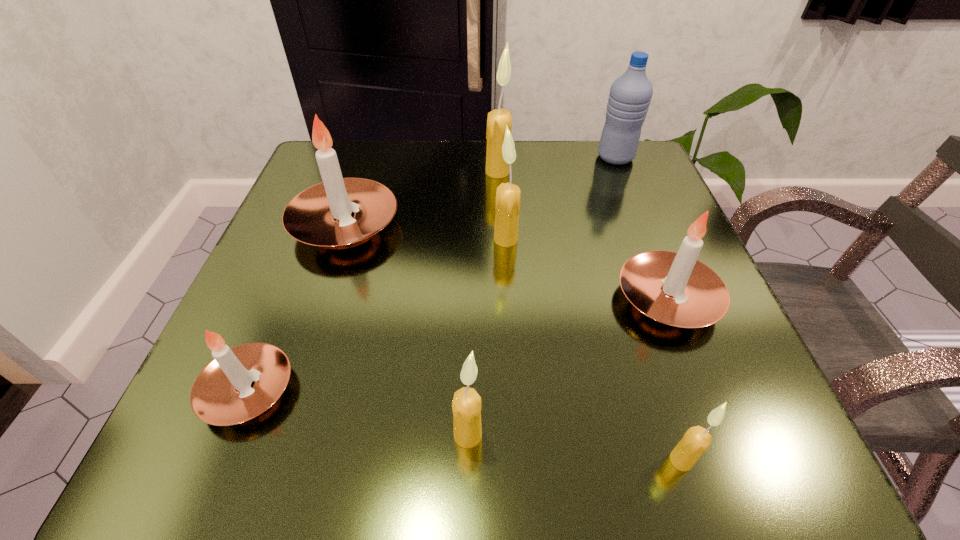
In order to click on vacant space at the far left corner of the desktop in this screenshot , I will do `click(384, 149)`.

Find the location of `vacant position at the far right corner of the desktop`. vacant position at the far right corner of the desktop is located at coordinates (617, 191).

The image size is (960, 540). I want to click on free space between the smallest cream candle and the farthest white candle, so (513, 343).

Locate an element on the screen. This screenshot has width=960, height=540. empty space that is in between the blue water bottle and the smallest white candle is located at coordinates (432, 274).

Identify the location of vacant area that lies between the second biggest cream candle and the leftmost cream candle. The height and width of the screenshot is (540, 960). (487, 337).

The height and width of the screenshot is (540, 960). I want to click on vacant area that lies between the rightmost white candle and the leftmost cream candle, so 567,367.

Locate an element on the screen. The width and height of the screenshot is (960, 540). free space between the farthest white candle and the farthest cream candle is located at coordinates (421, 199).

Locate an element on the screen. The width and height of the screenshot is (960, 540). free space between the water bottle and the nearest white candle is located at coordinates (432, 274).

You are a GUI agent. You are given a task and a screenshot of the screen. Output one action in this format:
    pyautogui.click(x=<x>, y=<y>)
    Task: Click on the vacant space in between the second biggest cream candle and the rightmost white candle
    The height and width of the screenshot is (540, 960).
    Given the screenshot: What is the action you would take?
    pyautogui.click(x=587, y=269)

Find the location of `empty location between the third smallest cream candle and the rightmost white candle`. empty location between the third smallest cream candle and the rightmost white candle is located at coordinates (587, 269).